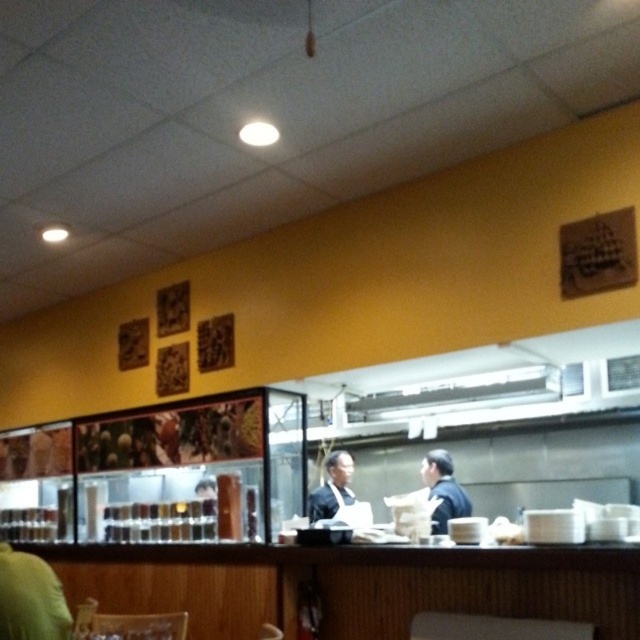
You are a delivery person who needs to place a package between the dark blue uniform at center and the dark blue suit at center. Can you fit the package which is 29 inches long in the space between them?

The distance between the dark blue uniform at center and the dark blue suit at center is 28.94 inches. Since the package is 29 inches long, it is slightly longer than the available space. Therefore, the package cannot fit between them.

Looking at this image, you are standing at the entrance of the dining establishment. You see a point marked at coordinates (x=444, y=490). What object is located at that point?

The dark blue uniform at center is located at point (x=444, y=490).

You are standing in the dining establishment and want to reach the point marked as point (444, 522). If you can walk 15 feet per minute, how many minutes will it take you to reach that point?

The point (444, 522) is 13.20 feet away from the viewer. At a walking speed of 15 feet per minute, it would take approximately 0.88 minutes to reach the point.